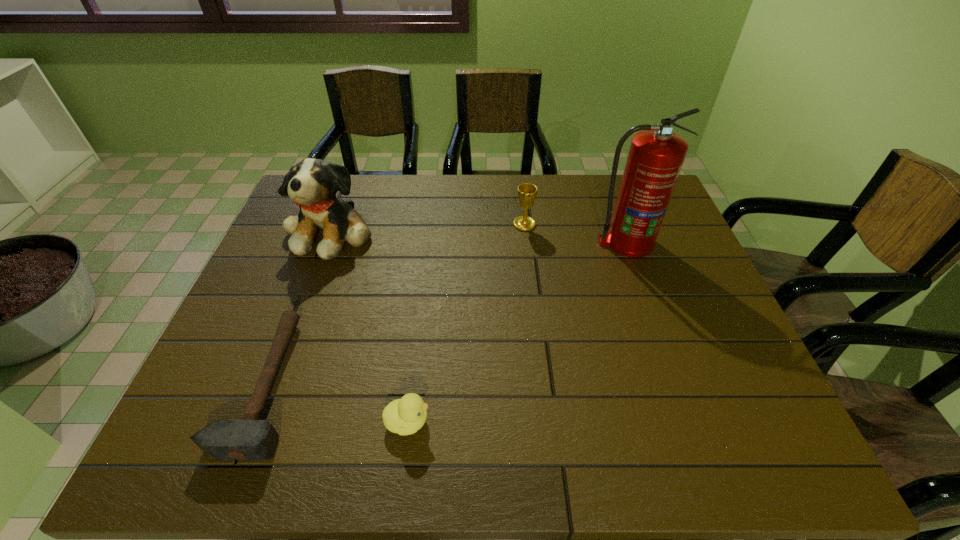
Where is `fire extinguisher`? The image size is (960, 540). fire extinguisher is located at coordinates [656, 155].

At what (x,y) coordinates should I click in order to perform the action: click on the rightmost object. Please return your answer as a coordinate pair (x, y). The height and width of the screenshot is (540, 960). Looking at the image, I should click on (656, 155).

Where is `the second tallest object`? The image size is (960, 540). the second tallest object is located at coordinates (312, 183).

This screenshot has width=960, height=540. I want to click on chalice, so click(526, 192).

The height and width of the screenshot is (540, 960). I want to click on the fourth object from left to right, so click(526, 192).

You are a GUI agent. You are given a task and a screenshot of the screen. Output one action in this format:
    pyautogui.click(x=<x>, y=<y>)
    Task: Click on the fourth tallest object
    This screenshot has width=960, height=540.
    Given the screenshot: What is the action you would take?
    (405, 416)

The width and height of the screenshot is (960, 540). Identify the location of duckling. (405, 416).

Find the location of a particular element. The width and height of the screenshot is (960, 540). hammer is located at coordinates (250, 438).

Where is `vacant space located 0.170m on the instruction side of the rightmost object`? This screenshot has height=540, width=960. vacant space located 0.170m on the instruction side of the rightmost object is located at coordinates (648, 304).

The height and width of the screenshot is (540, 960). Find the location of `free space located 0.370m at the face of the second tallest object`. free space located 0.370m at the face of the second tallest object is located at coordinates (276, 379).